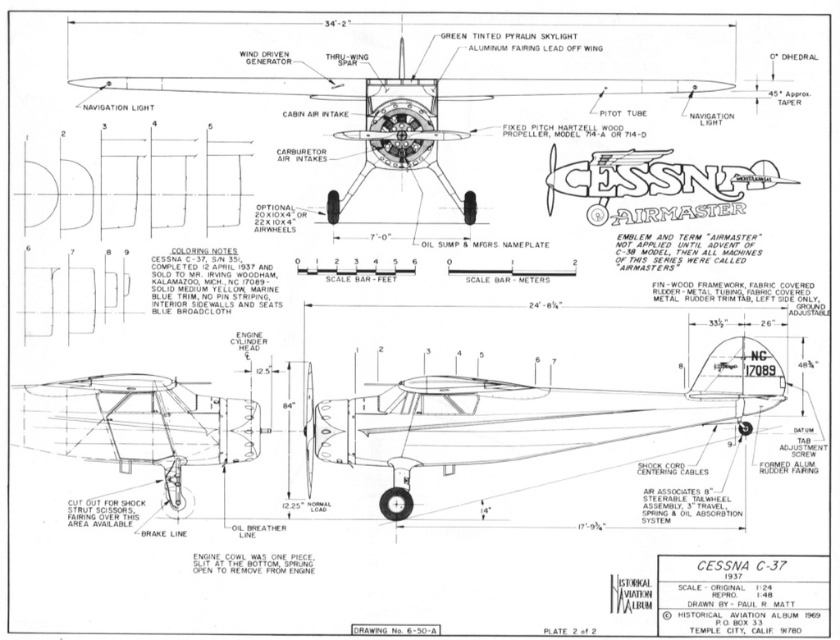
Question: Is matte black airplane at center above metallic silver propeller at center?

Choices:
 (A) yes
 (B) no

Answer: (A)

Question: Which of the following is the closest to the observer?

Choices:
 (A) (621, 90)
 (B) (596, 413)
 (C) (35, 400)

Answer: (C)

Question: From the image, what is the correct spatial relationship of matte black propeller at center in relation to metallic silver propeller at center?

Choices:
 (A) left
 (B) right

Answer: (B)

Question: Which point is closer to the camera?

Choices:
 (A) matte black propeller at center
 (B) metallic silver propeller at center

Answer: (B)

Question: Which point appears closest to the camera in this image?

Choices:
 (A) (231, 454)
 (B) (281, 74)
 (C) (423, 464)

Answer: (A)

Question: Is matte black airplane at center bigger than metallic silver propeller at center?

Choices:
 (A) yes
 (B) no

Answer: (A)